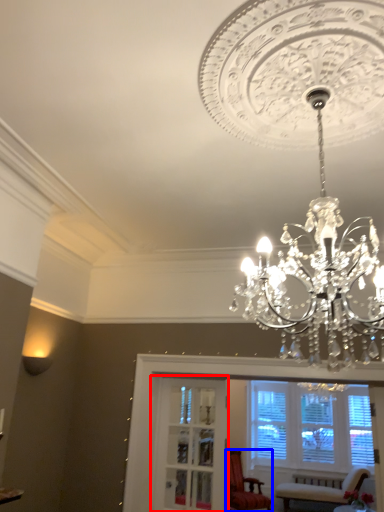
Question: Among these objects, which one is nearest to the camera, glass door (highlighted by a red box) or chair (highlighted by a blue box)?

Choices:
 (A) glass door
 (B) chair

Answer: (A)